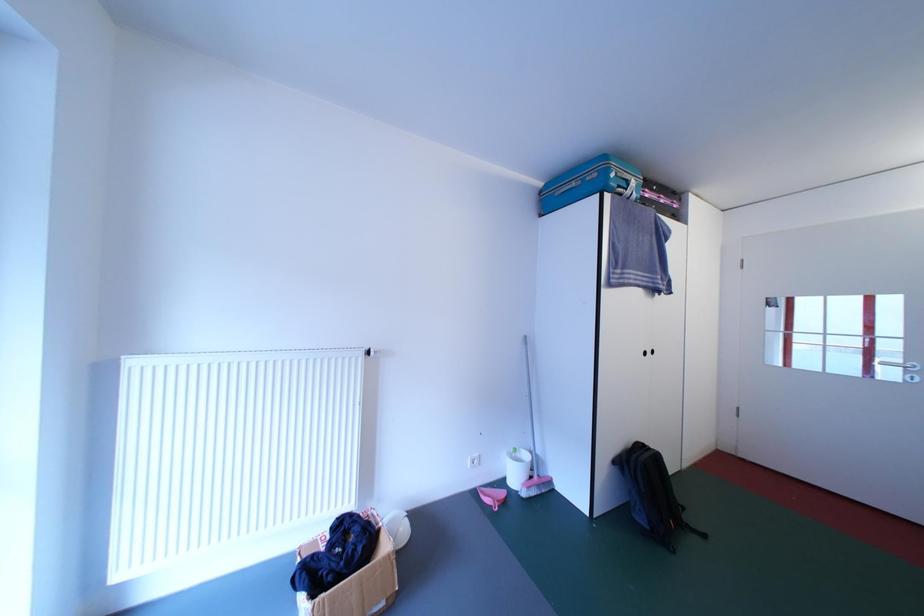
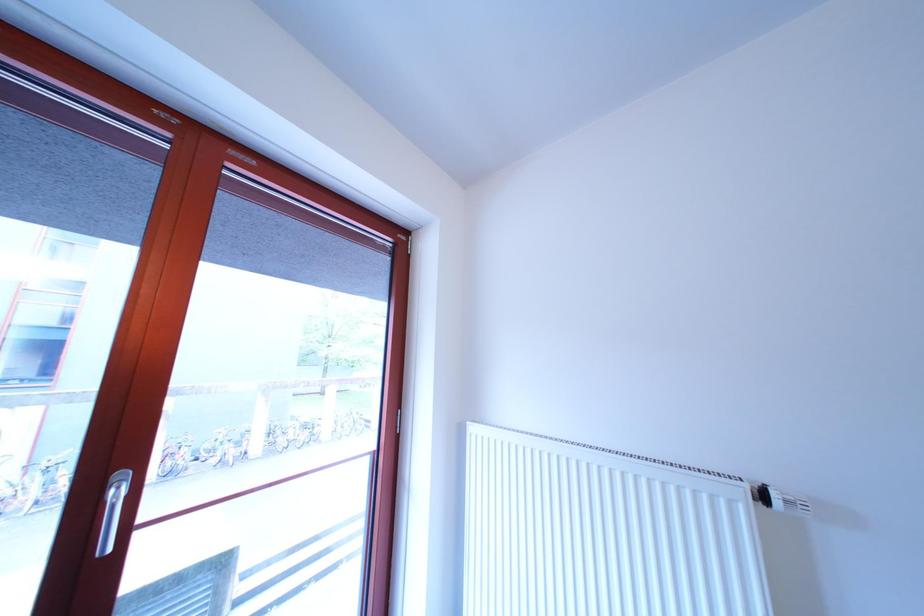
Question: The camera is either moving clockwise (left) or counter-clockwise (right) around the object. The first image is from the beginning of the video and the second image is from the end. Is the camera moving left or right when shooting the video?

Choices:
 (A) Left
 (B) Right

Answer: (B)